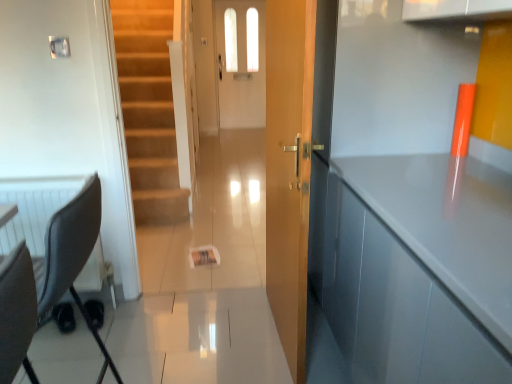
Where is `free spot to the left of wooden door at center`? The image size is (512, 384). free spot to the left of wooden door at center is located at coordinates (207, 331).